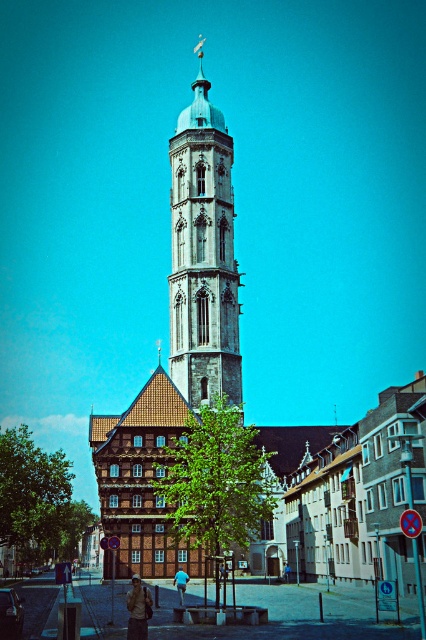
Between point (184, 528) and point (19, 481), which one is positioned behind?

The point (19, 481) is behind.

You are a GUI agent. You are given a task and a screenshot of the screen. Output one action in this format:
    pyautogui.click(x=<x>, y=<y>)
    Task: Click on the green leafy tree at center
    
    Given the screenshot: What is the action you would take?
    pyautogui.click(x=215, y=483)

Find the location of a particular element. Image resolution: width=426 pixels, height=640 pixels. green leafy tree at center is located at coordinates (215, 483).

Can you confirm if green leafy tree at lower left is positioned above camouflage jacket at lower center?

No.

Consider the image. Between green leafy tree at lower left and camouflage jacket at lower center, which one appears on the right side from the viewer's perspective?

camouflage jacket at lower center is more to the right.

At what (x,y) coordinates should I click in order to perform the action: click on green leafy tree at lower left. Please return your answer as a coordinate pair (x, y). Image resolution: width=426 pixels, height=640 pixels. Looking at the image, I should click on (37, 499).

Between blue cotton shirt at center and blue denim jacket at center, which one has less height?

Standing shorter between the two is blue cotton shirt at center.

Does point (180, 582) come closer to viewer compared to point (284, 577)?

Yes, point (180, 582) is in front of point (284, 577).

Measure the distance between blue cotton shirt at center and camera.

blue cotton shirt at center is 60.71 meters away from camera.

Locate an element on the screen. The image size is (426, 640). blue cotton shirt at center is located at coordinates (181, 582).